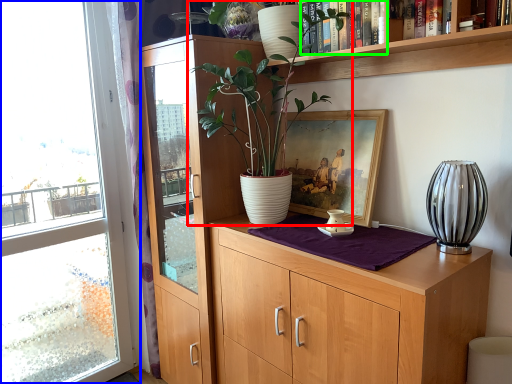
Question: Which object is the farthest from houseplant (highlighted by a red box)? Choose among these: window (highlighted by a blue box) or book (highlighted by a green box).

Choices:
 (A) window
 (B) book

Answer: (A)